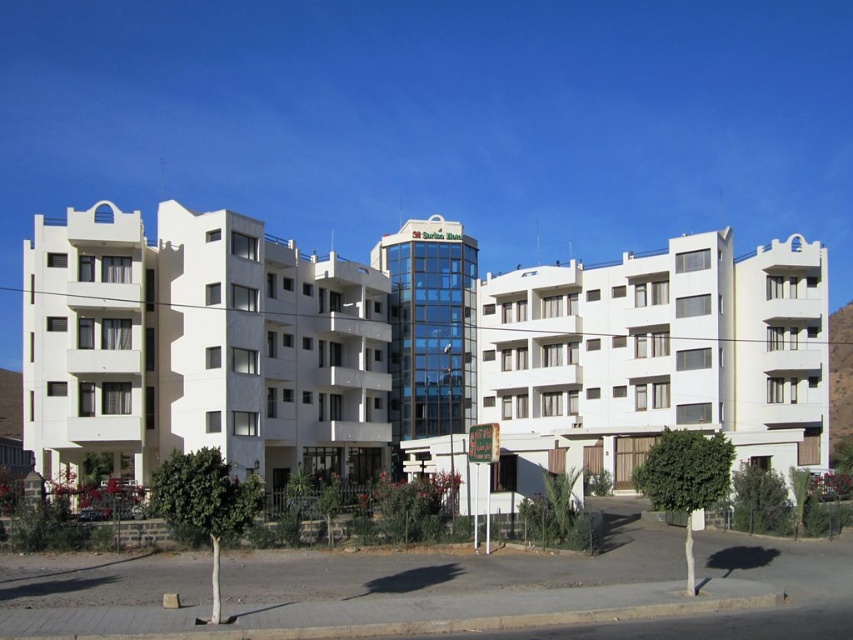
You are standing in the middle of the street looking at the buildings. Which building is closer to your right side, the white smooth building at center or the white smooth building at left?

The white smooth building at center is to the right of the white smooth building at left, so the white smooth building at center is closer to your right side.

You are a delivery person with a cart that is 2 meters wide. You need to navigate between the white smooth building at center and the white matte building at center. Can your cart fit through the space between them?

The white smooth building at center is 7.37 meters from the white matte building at center. Since your cart is 2 meters wide, it can easily fit through the space between them as the distance is more than sufficient.

You are standing at the point marked as point [199,348]. Which building are you facing? Please choose from the following options and explain your reasoning. The options are the white smooth building at left and the white building to the right.

You are facing the white smooth building at left because the point [199,348] is located at its position according to the coordinates provided.